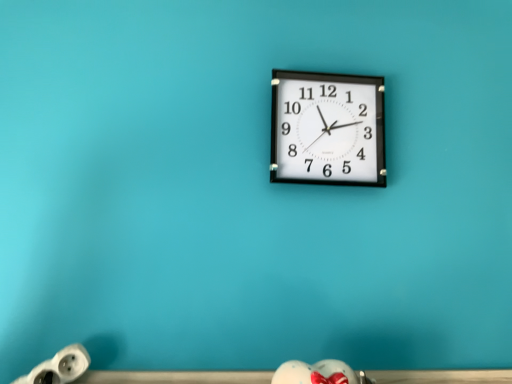
This screenshot has height=384, width=512. What do you see at coordinates (327, 129) in the screenshot?
I see `black plastic wall clock at center` at bounding box center [327, 129].

Where is `black plastic wall clock at center`? The image size is (512, 384). black plastic wall clock at center is located at coordinates (327, 129).

The image size is (512, 384). What are the coordinates of `white plastic plug at lower left` in the screenshot? It's located at (59, 367).

Describe the element at coordinates (59, 367) in the screenshot. I see `white plastic plug at lower left` at that location.

Image resolution: width=512 pixels, height=384 pixels. What are the coordinates of `black plastic wall clock at center` in the screenshot? It's located at (327, 129).

Would you say black plastic wall clock at center is to the left or to the right of white plastic plug at lower left in the picture?

In the image, black plastic wall clock at center appears on the right side of white plastic plug at lower left.

In the scene shown: Is black plastic wall clock at center positioned in front of white plastic plug at lower left?

No, black plastic wall clock at center is further to the viewer.

Is point (290, 127) farther from viewer compared to point (42, 381)?

Yes.

From the image's perspective, which one is positioned lower, black plastic wall clock at center or white plastic plug at lower left?

white plastic plug at lower left appears lower in the image.

From a real-world perspective, which object stands above the other?

black plastic wall clock at center, from a real-world perspective.

In terms of width, does black plastic wall clock at center look wider or thinner when compared to white plastic plug at lower left?

Clearly, black plastic wall clock at center has less width compared to white plastic plug at lower left.

Based on the photo, can you confirm if black plastic wall clock at center is taller than white plastic plug at lower left?

Yes, black plastic wall clock at center is taller than white plastic plug at lower left.

Does black plastic wall clock at center have a larger size compared to white plastic plug at lower left?

Yes.

Is black plastic wall clock at center not inside white plastic plug at lower left?

Indeed, black plastic wall clock at center is completely outside white plastic plug at lower left.

Is the surface of black plastic wall clock at center in direct contact with white plastic plug at lower left?

They are not placed beside each other.

Is black plastic wall clock at center looking in the opposite direction of white plastic plug at lower left?

No, black plastic wall clock at center is not facing the opposite direction of white plastic plug at lower left.

How different are the orientations of black plastic wall clock at center and white plastic plug at lower left in degrees?

The facing directions of black plastic wall clock at center and white plastic plug at lower left are 5.26 degrees apart.

Locate an element on the screen. The height and width of the screenshot is (384, 512). toy that appears below the black plastic wall clock at center (from the image's perspective) is located at coordinates (59, 367).

Between white plastic plug at lower left and black plastic wall clock at center, which one appears on the left side from the viewer's perspective?

white plastic plug at lower left.

Looking at this image, considering the relative positions of white plastic plug at lower left and black plastic wall clock at center in the image provided, is white plastic plug at lower left behind black plastic wall clock at center?

No, white plastic plug at lower left is in front of black plastic wall clock at center.

Is point (46, 365) in front of point (346, 87)?

Yes, point (46, 365) is closer to viewer.

From the image's perspective, between white plastic plug at lower left and black plastic wall clock at center, who is located below?

white plastic plug at lower left, from the image's perspective.

From a real-world perspective, is white plastic plug at lower left physically located above or below black plastic wall clock at center?

Clearly, from a real-world perspective, white plastic plug at lower left is below black plastic wall clock at center.

Between white plastic plug at lower left and black plastic wall clock at center, which one has larger width?

Wider between the two is white plastic plug at lower left.

Considering the sizes of white plastic plug at lower left and black plastic wall clock at center in the image, is white plastic plug at lower left taller or shorter than black plastic wall clock at center?

Considering their sizes, white plastic plug at lower left has less height than black plastic wall clock at center.

Between white plastic plug at lower left and black plastic wall clock at center, which one has smaller size?

With smaller size is white plastic plug at lower left.

Is white plastic plug at lower left not inside black plastic wall clock at center?

white plastic plug at lower left is positioned outside black plastic wall clock at center.

Are white plastic plug at lower left and black plastic wall clock at center making contact?

No, white plastic plug at lower left is not in contact with black plastic wall clock at center.

Does white plastic plug at lower left turn towards black plastic wall clock at center?

No, white plastic plug at lower left is not facing towards black plastic wall clock at center.

Can you tell me how much white plastic plug at lower left and black plastic wall clock at center differ in facing direction?

The facing directions of white plastic plug at lower left and black plastic wall clock at center are 5.26 degrees apart.

Measure the distance between white plastic plug at lower left and black plastic wall clock at center.

white plastic plug at lower left and black plastic wall clock at center are 23.97 inches apart.

At what (x,y) coordinates should I click in order to perform the action: click on toy that is under the black plastic wall clock at center (from a real-world perspective). Please return your answer as a coordinate pair (x, y). This screenshot has height=384, width=512. Looking at the image, I should click on (59, 367).

The width and height of the screenshot is (512, 384). I want to click on wall clock on the right of white plastic plug at lower left, so click(x=327, y=129).

Locate an element on the screen. toy below the black plastic wall clock at center (from a real-world perspective) is located at coordinates (59, 367).